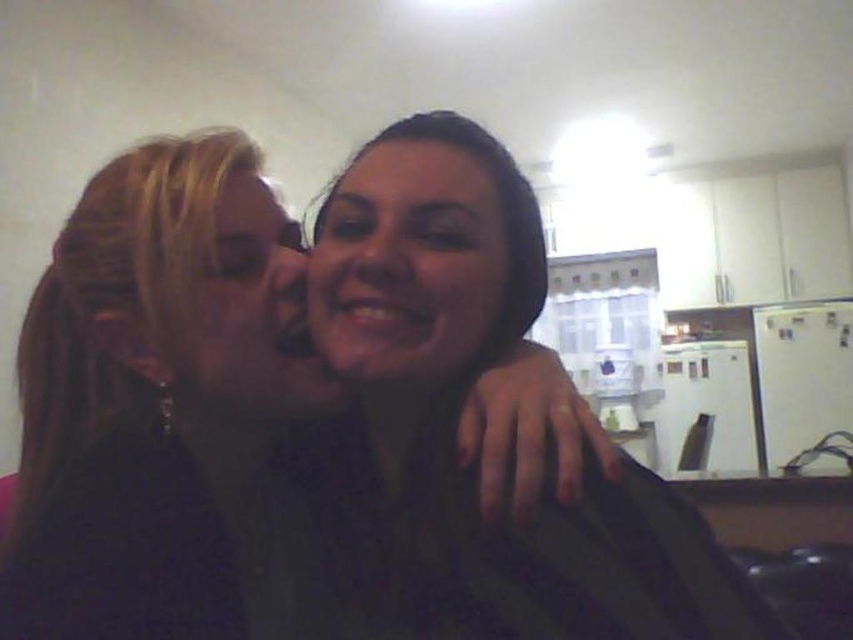
You are designing a poster for a clothing brand and need to highlight either the matte black shirt at center or the smooth skin face at center. Based on their sizes in the image, which one should you choose to ensure it stands out more?

The matte black shirt at center is larger in size than the smooth skin face at center, so choosing the matte black shirt at center would make it stand out more in the poster.

You are a photographer trying to capture a portrait of both the smooth skin face at center and the matte black face at center in this kitchen scene. Since lighting can affect how textures appear, which face might require more careful lighting adjustments to ensure details are visible?

The matte black face at center might require more careful lighting adjustments because smooth surfaces like the smooth skin face at center typically reflect light more evenly, whereas matte or darker surfaces can absorb light and make details harder to capture clearly.